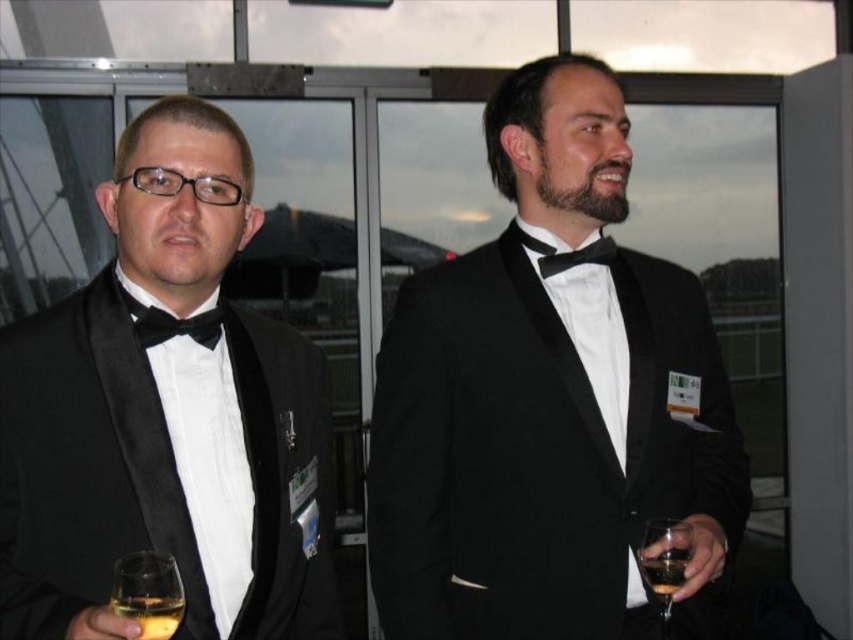
Question: Does matte black tuxedo at center have a lesser width compared to translucent glass wine at center?

Choices:
 (A) yes
 (B) no

Answer: (B)

Question: Which is nearer to the black satin tuxedo at center?

Choices:
 (A) black satin bow tie at center
 (B) matte black bow tie at left
 (C) matte black tuxedo at center

Answer: (A)

Question: Among these objects, which one is nearest to the camera?

Choices:
 (A) matte black bow tie at left
 (B) black satin tuxedo at center

Answer: (A)

Question: Does black satin tuxedo at center have a lesser width compared to translucent glass wine at left?

Choices:
 (A) yes
 (B) no

Answer: (B)

Question: Estimate the real-world distances between objects in this image. Which object is closer to the translucent glass wine at right?

Choices:
 (A) translucent glass wine at left
 (B) black satin bow tie at center
 (C) matte black bow tie at left
 (D) black satin tuxedo at center

Answer: (D)

Question: Is matte black tuxedo at center above translucent glass wine at right?

Choices:
 (A) no
 (B) yes

Answer: (B)